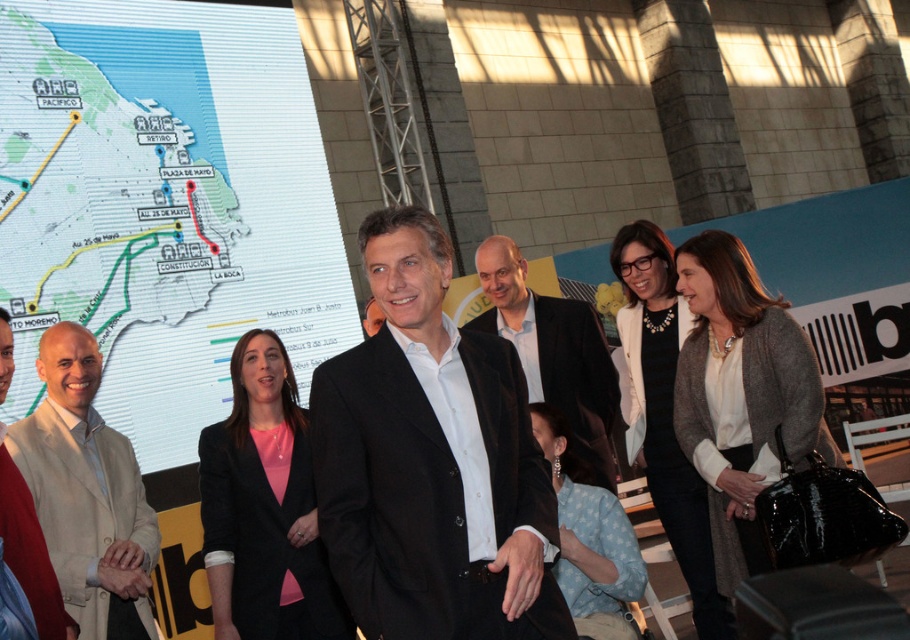
Question: Is matte black blazer at center thinner than velvet black suit at center?

Choices:
 (A) no
 (B) yes

Answer: (B)

Question: Considering the real-world distances, which object is closest to the matte black blazer at center?

Choices:
 (A) black glossy suit at center
 (B) beige fabric jacket at left
 (C) dark gray wool blazer at center
 (D) matte map at upper left

Answer: (B)

Question: Is matte black blazer at center above velvet black suit at center?

Choices:
 (A) no
 (B) yes

Answer: (A)

Question: Considering the real-world distances, which object is closest to the black glossy suit at center?

Choices:
 (A) beige fabric jacket at left
 (B) dark gray wool blazer at center

Answer: (A)

Question: Does matte map at upper left have a smaller size compared to beige fabric jacket at left?

Choices:
 (A) no
 (B) yes

Answer: (B)

Question: Which of the following is the closest to the observer?

Choices:
 (A) (506, 438)
 (B) (507, 285)

Answer: (A)